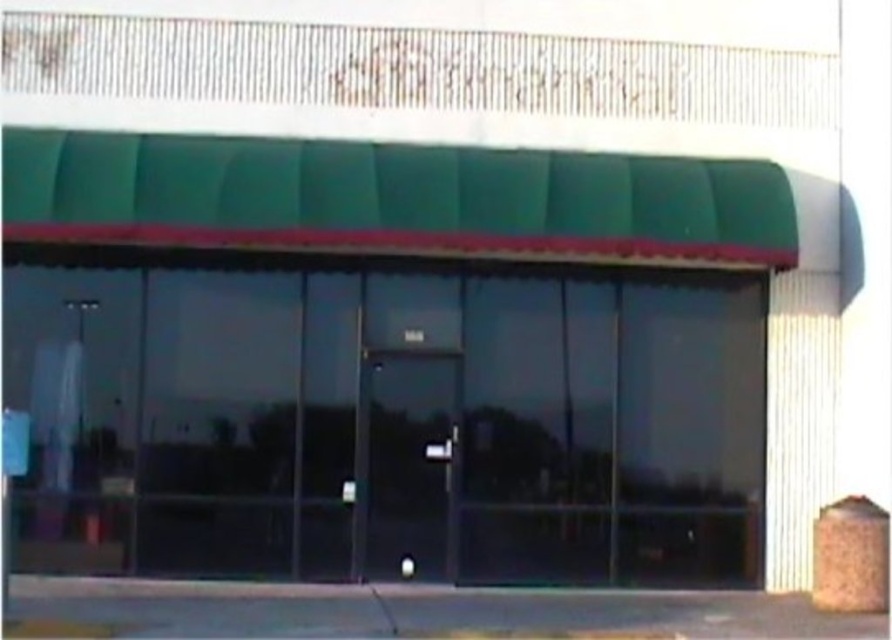
You are a delivery person trying to see if the transparent glass window at center and the transparent glass door at center are the same height. What can you observe about their heights?

The transparent glass window at center has a greater height compared to the transparent glass door at center, so they are not the same height.

You are a delivery person trying to enter the building through the transparent glass door at center. The door is slightly ajar, but you notice the transparent glass window at center is wider than the door. How might the width difference affect your ability to carry a large package through the door?

The transparent glass window at center is wider than the transparent glass door at center. Since the door is narrower than the window, you may need to adjust your approach when carrying a large package through the transparent glass door at center to ensure it fits through the narrower opening.